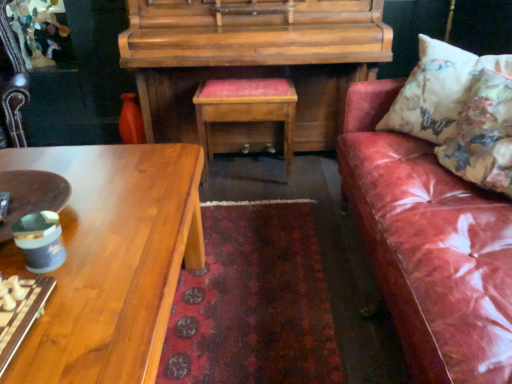
Identify the location of free spot to the right of matte brown bowl at left. The height and width of the screenshot is (384, 512). (134, 246).